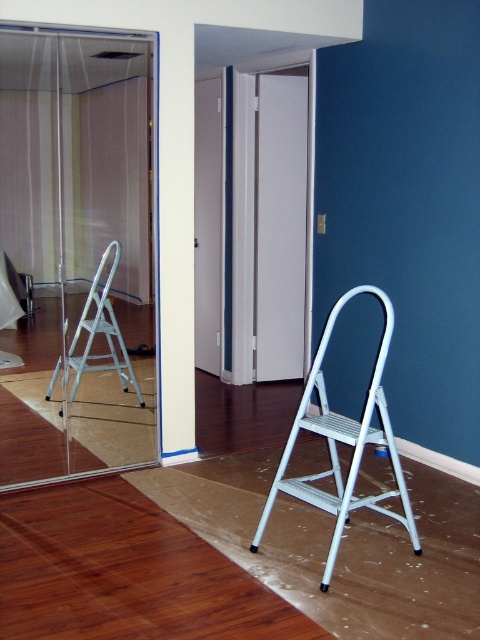
Question: Is brown wood flooring at lower center behind white metallic step stool at center?

Choices:
 (A) no
 (B) yes

Answer: (A)

Question: Which object is farther from the camera taking this photo?

Choices:
 (A) silver metallic step ladder at left
 (B) transparent glass door at upper left
 (C) brown wood flooring at lower center
 (D) white matte screen door at center

Answer: (D)

Question: Which object is closer to the camera taking this photo?

Choices:
 (A) silver metallic step ladder at left
 (B) transparent glass door at upper left
 (C) white matte screen door at center
 (D) white metallic step stool at center

Answer: (D)

Question: Which point is closer to the camera?

Choices:
 (A) (267, 227)
 (B) (82, 80)

Answer: (A)

Question: Does brown wood flooring at lower center appear on the right side of white metallic step stool at center?

Choices:
 (A) yes
 (B) no

Answer: (B)

Question: Is transparent glass door at upper left to the left of brown wood flooring at lower center from the viewer's perspective?

Choices:
 (A) no
 (B) yes

Answer: (B)